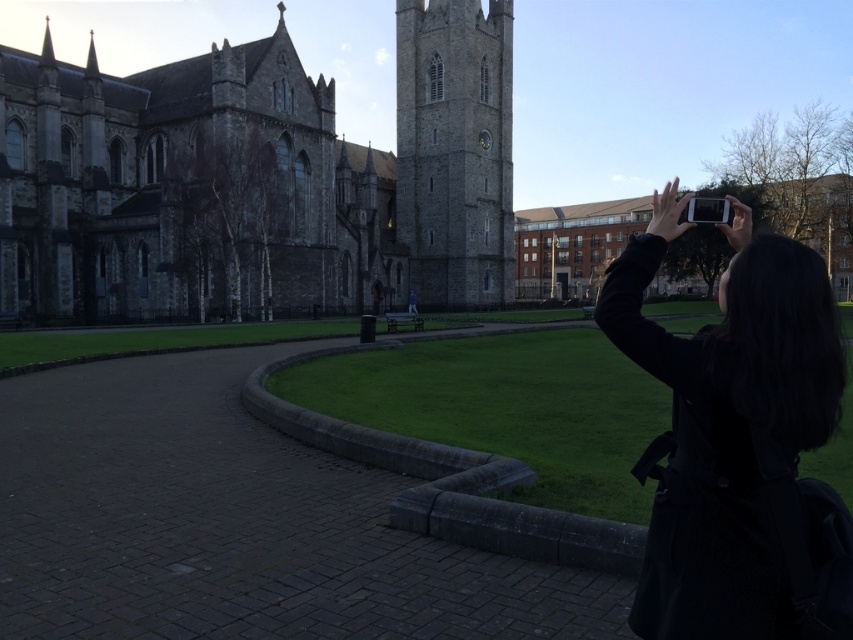
Based on the photo, does gray stone church at left appear over black fabric coat at upper right?

Yes.

Between gray stone church at left and black fabric coat at upper right, which one has less height?

With less height is black fabric coat at upper right.

This screenshot has width=853, height=640. What do you see at coordinates (258, 179) in the screenshot?
I see `gray stone church at left` at bounding box center [258, 179].

Where is `gray stone church at left`? gray stone church at left is located at coordinates (258, 179).

Between black fabric coat at upper right and gray stone tower at center, which one appears on the left side from the viewer's perspective?

gray stone tower at center is more to the left.

Does point (618, 317) come closer to viewer compared to point (503, 125)?

That is True.

Is point (740, 388) positioned before point (440, 298)?

That is True.

Identify the location of black fabric coat at upper right. (730, 429).

This screenshot has height=640, width=853. I want to click on gray stone church at left, so click(x=258, y=179).

Is point (146, 97) behind point (421, 150)?

No.

The height and width of the screenshot is (640, 853). I want to click on gray stone church at left, so click(258, 179).